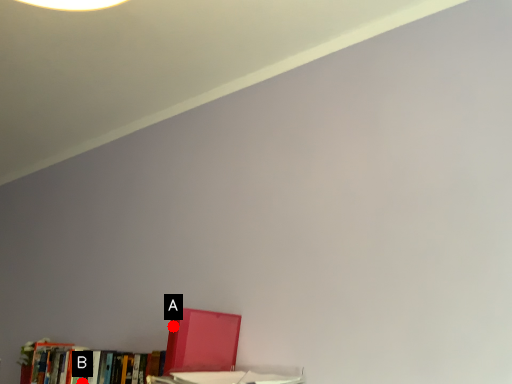
Question: Two points are circled on the image, labeled by A and B beside each circle. Which point is farther from the camera taking this photo?

Choices:
 (A) A is further
 (B) B is further

Answer: (B)